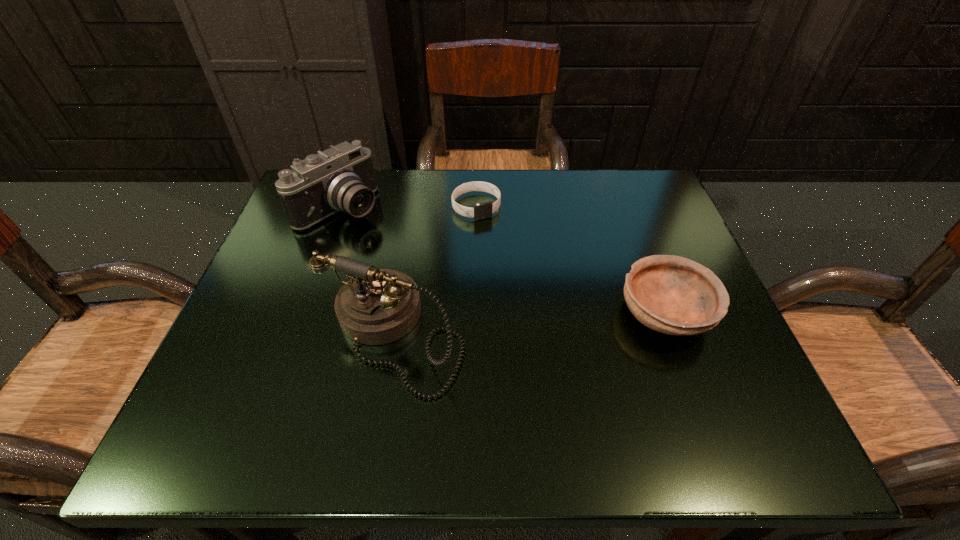
In order to click on vacant area between the shortest object and the camera in this screenshot , I will do `click(409, 207)`.

Image resolution: width=960 pixels, height=540 pixels. In order to click on unoccupied position between the camera and the wristband in this screenshot , I will do `click(409, 207)`.

Locate an element on the screen. The height and width of the screenshot is (540, 960). unoccupied position between the shortest object and the telephone is located at coordinates (435, 271).

Where is `vacant area that lies between the wristband and the telephone`? vacant area that lies between the wristband and the telephone is located at coordinates (435, 271).

Identify which object is the second nearest to the telephone. Please provide its 2D coordinates. Your answer should be formatted as a tuple, i.e. [(x, y)], where the tuple contains the x and y coordinates of a point satisfying the conditions above.

[(480, 211)]

Find the location of `object identified as the third closest to the camera`. object identified as the third closest to the camera is located at coordinates (673, 295).

At what (x,y) coordinates should I click in order to perform the action: click on free spot that satisfies the following two spatial constraints: 1. on the front side of the telephone; 2. on the left side of the camera. Please return your answer as a coordinate pair (x, y). Image resolution: width=960 pixels, height=540 pixels. Looking at the image, I should click on (295, 335).